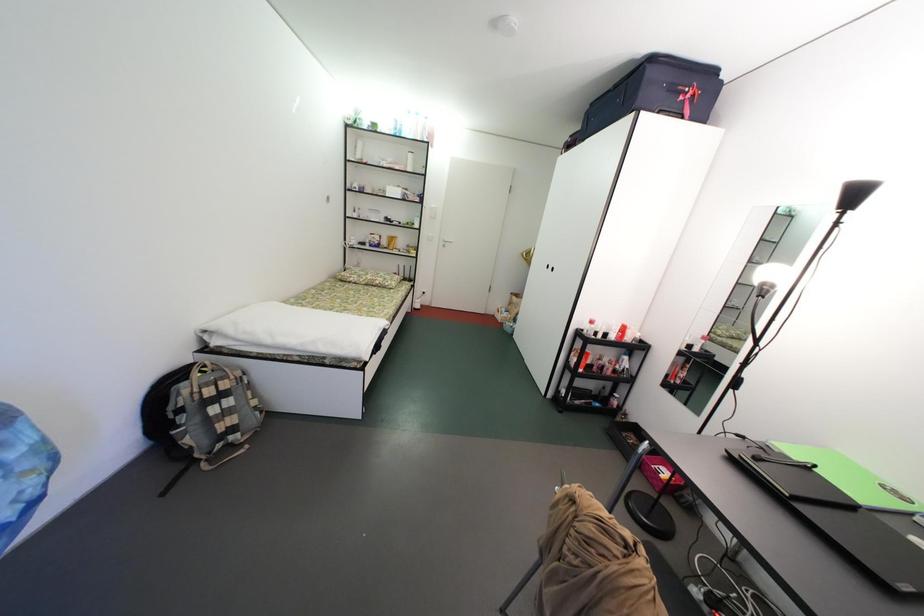
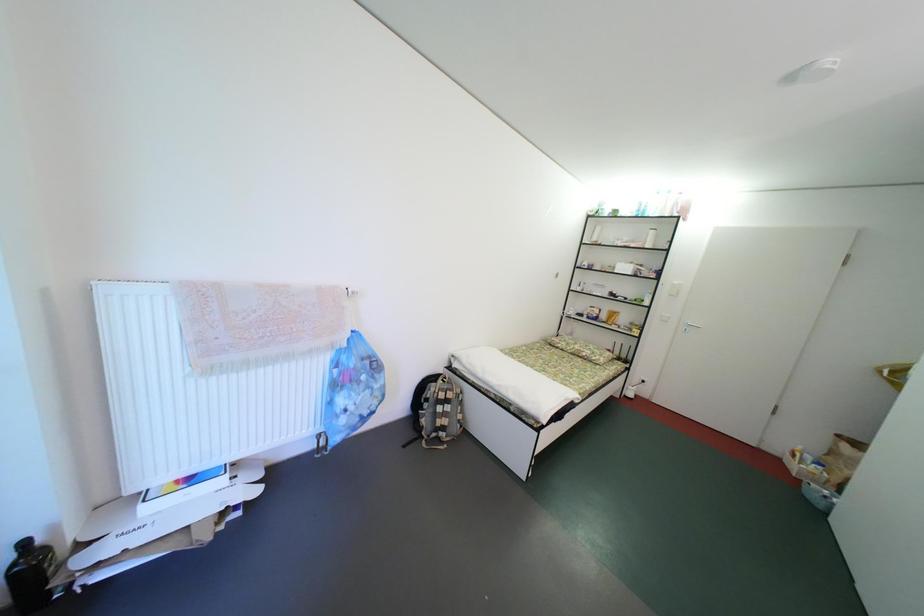
Question: The first image is from the beginning of the video and the second image is from the end. How did the camera likely rotate when shooting the video?

Choices:
 (A) Left
 (B) Right
 (C) Up
 (D) Down

Answer: (A)